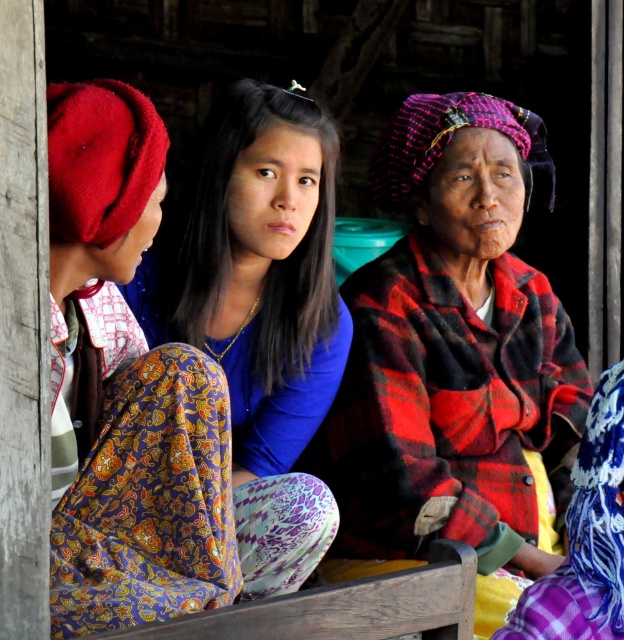
You are a fashion designer observing the rustic scene. You notice the matte red beret at left and the matte blue blouse at center. Which accessory or clothing item has a smaller width?

The matte red beret at left is thinner than the matte blue blouse at center, so the matte red beret at left has a smaller width.

You are an observer standing in front of the scene. You notice the plaid fabric shawl at right and the matte blue blouse at center. Which object is taller?

The plaid fabric shawl at right is taller than the matte blue blouse at center.

From the picture: You are trying to decide whether to place a decorative pillow on the plaid fabric shawl at right or the matte blue blouse at center. Based on their positions, which surface would allow the pillow to be more visible to someone entering the room?

The plaid fabric shawl at right is positioned below the matte blue blouse at center, so placing the pillow on the matte blue blouse at center would make it more visible to someone entering the room since it is higher up.